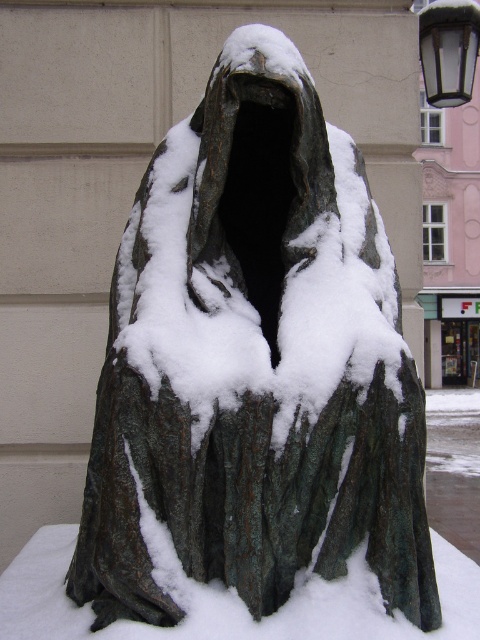
You are an artist planning to create a miniature version of this sculpture. You need to decide the scale based on the sizes of the white frosty snow at center and the metallic glass lamp at upper right. Which object should you use as the reference for scaling to ensure the miniature maintains the correct proportions?

The white frosty snow at center is larger in size than the metallic glass lamp at upper right. To maintain correct proportions, you should use the white frosty snow at center as the reference for scaling since it is the larger object and scaling based on it will ensure the metallic glass lamp at upper right is proportionally smaller in the miniature.

You are an artist planning to paint the sculpture scene. You need to decide which object, the white frosty snow at center or the metallic glass lamp at upper right, you should paint first based on their positions. Which one should you start with?

The metallic glass lamp at upper right should be painted first because the white frosty snow at center is shorter than it, meaning the snow is lower in the image and might be covered by the lamp when painting from top to bottom.